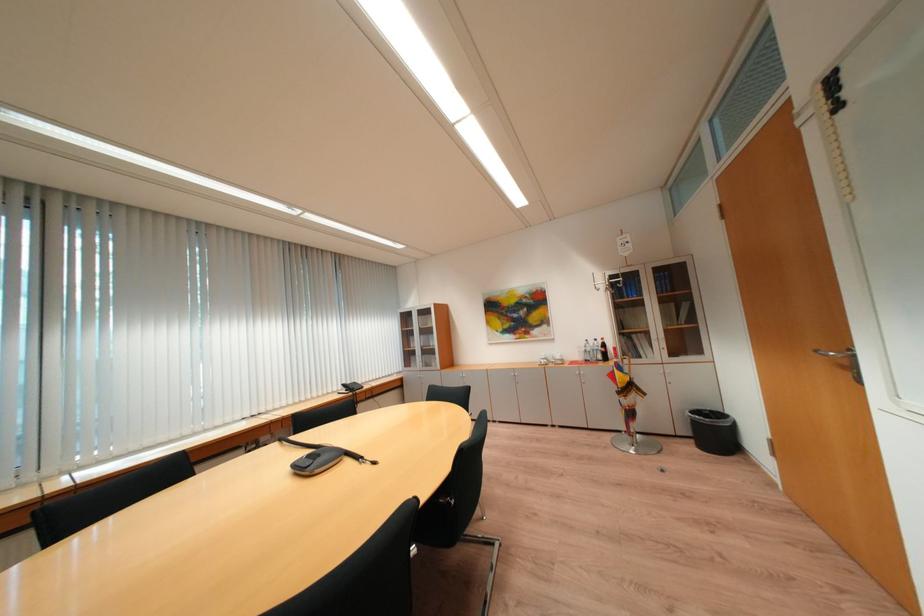
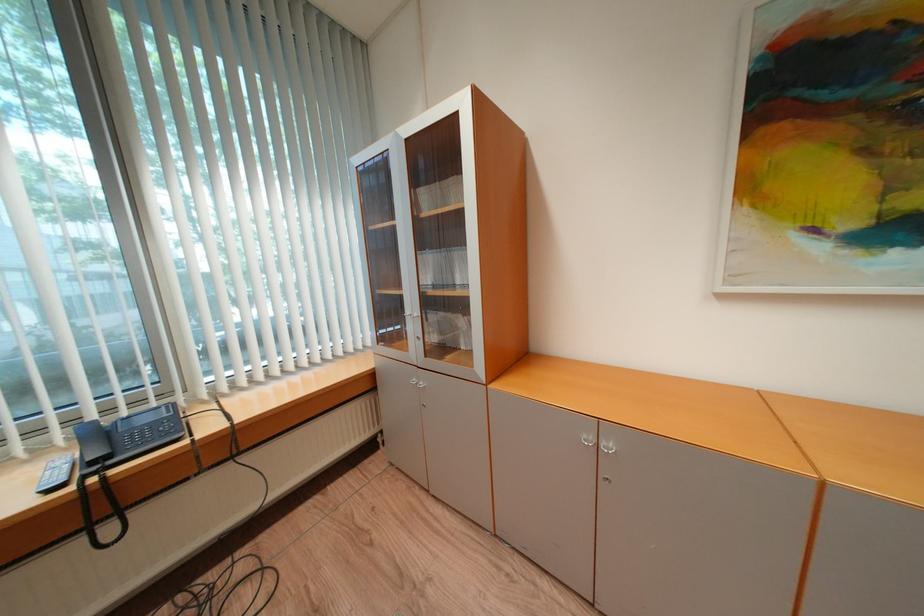
Question: I am providing you with two images of the same scene from different viewpoints. Please identify which objects are invisible in image2.

Choices:
 (A) cabinet lock
 (B) telephone handset
 (C) telephone keypad buttons
 (D) none of these

Answer: (D)